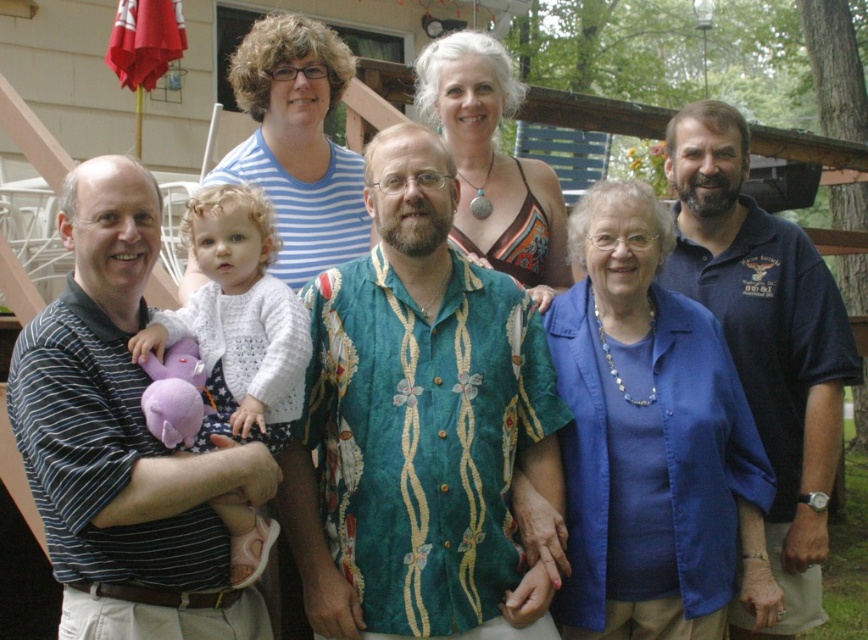
Question: Does green floral shirt at center have a larger size compared to dark blue polo shirt at right?

Choices:
 (A) no
 (B) yes

Answer: (A)

Question: Is green floral shirt at center positioned behind white knitted sweater at center?

Choices:
 (A) yes
 (B) no

Answer: (A)

Question: Is green floral shirt at center smaller than dark blue polo shirt at right?

Choices:
 (A) no
 (B) yes

Answer: (B)

Question: Which object is the farthest from the green floral shirt at center?

Choices:
 (A) dark blue polo shirt at right
 (B) white knitted sweater at center

Answer: (A)

Question: Considering the real-world distances, which object is farthest from the dark blue polo shirt at right?

Choices:
 (A) striped shirt at left
 (B) green floral shirt at center
 (C) white knitted sweater at center

Answer: (A)

Question: Which point appears farthest from the camera in this image?

Choices:
 (A) (676, 221)
 (B) (352, 388)
 (C) (273, 532)

Answer: (A)